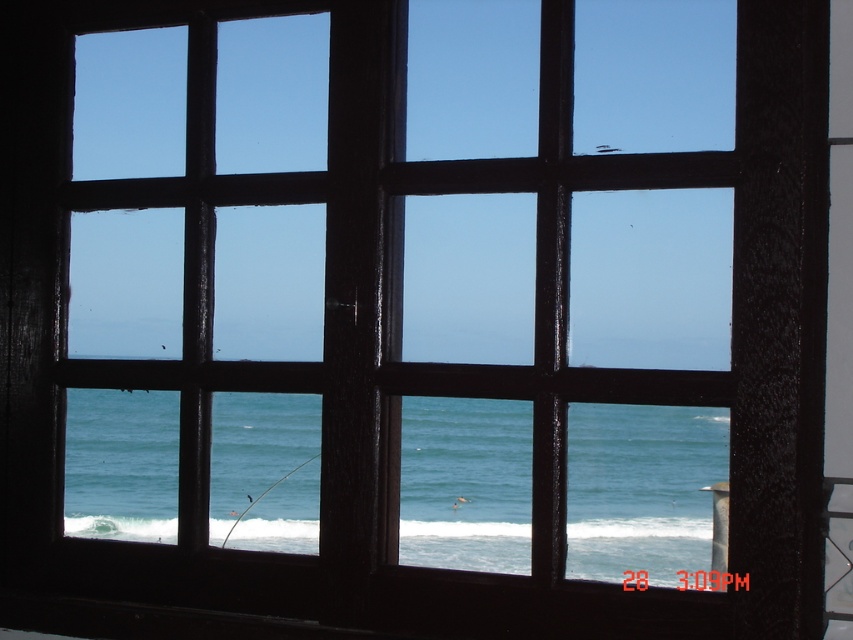
What do you see at coordinates (641, 488) in the screenshot? I see `blue water at center` at bounding box center [641, 488].

Consider the image. Who is more distant from viewer, (300, 420) or (700, 529)?

Positioned behind is point (300, 420).

Describe the element at coordinates (641, 488) in the screenshot. The height and width of the screenshot is (640, 853). I see `blue water at center` at that location.

At what (x,y) coordinates should I click in order to perform the action: click on blue water at center. Please return your answer as a coordinate pair (x, y). Looking at the image, I should click on (641, 488).